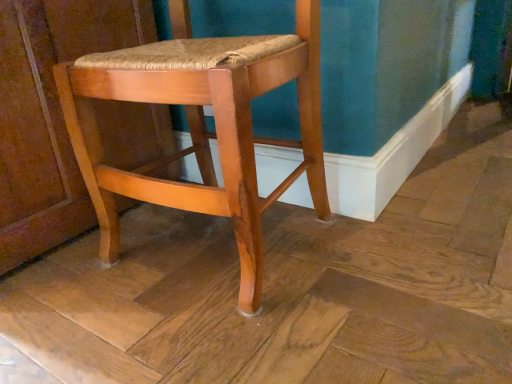
Describe the element at coordinates (202, 125) in the screenshot. I see `shiny wood chair at center` at that location.

Find the location of a particular element. The image size is (512, 384). shiny wood chair at center is located at coordinates (202, 125).

In order to face shiny wood chair at center, should I rotate leftwards or rightwards?

To align with it, rotate left about 5.535°.

I want to click on shiny wood chair at center, so click(x=202, y=125).